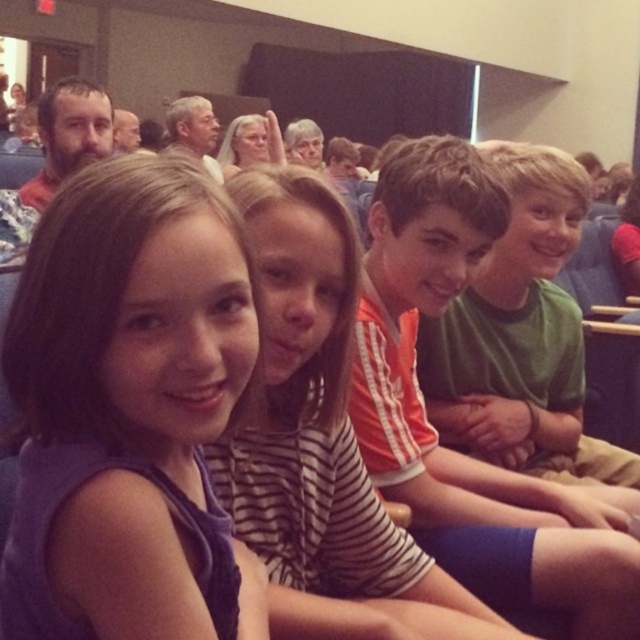
You are a photographer standing at the back of the auditorium. You want to take a photo of the striped shirt at center and gray hair at upper center so that both are clearly visible in the frame. Given that your camera has a maximum focus range of 2.5 meters, will you be able to capture both subjects in focus without moving closer?

The distance between the striped shirt at center and gray hair at upper center is 2.68 meters, which exceeds the camera maximum focus range of 2.5 meters. Therefore, you cannot capture both subjects in focus without moving closer.

You are a photographer trying to capture a photo of the striped shirt at center and the gray hair at upper center. Which object should you focus on first to ensure both are in focus?

The striped shirt at center is closer to the viewer than the gray hair at upper center. To ensure both are in focus, you should focus on the striped shirt at center first as it is closer, allowing the gray hair at upper center to fall within the depth of field.

You are a photographer trying to capture a photo of the green matte shirt at center and the matte black hair at upper left. Which object is positioned closer to the camera?

The green matte shirt at center is closer to the viewer than matte black hair at upper left, so the green matte shirt at center would appear closer to the camera.